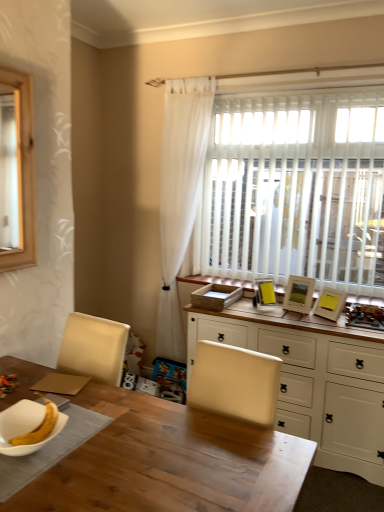
Find the location of a particular element. This screenshot has height=512, width=384. white glossy bowl at lower left is located at coordinates click(x=25, y=426).

At what (x,y) coordinates should I click in order to perform the action: click on white sheer curtain at upper right. Please return your answer as a coordinate pair (x, y). The height and width of the screenshot is (512, 384). Looking at the image, I should click on (180, 195).

The image size is (384, 512). Describe the element at coordinates (180, 195) in the screenshot. I see `white sheer curtain at upper right` at that location.

Image resolution: width=384 pixels, height=512 pixels. Describe the element at coordinates (170, 462) in the screenshot. I see `wooden table at center` at that location.

Locate an element on the screen. This screenshot has width=384, height=512. matte yellow picture frame at upper right, the first picture frame from the left is located at coordinates (264, 293).

From the picture: From a real-world perspective, is white glossy bowl at lower left beneath wooden photo frame at right, the second picture frame in the left-to-right sequence?

Yes.

From the image's perspective, who appears lower, white glossy bowl at lower left or wooden photo frame at right, the second picture frame viewed from the right?

white glossy bowl at lower left, from the image's perspective.

In the image, is white glossy bowl at lower left positioned in front of or behind wooden photo frame at right, the second picture frame viewed from the right?

white glossy bowl at lower left is positioned closer to the viewer than wooden photo frame at right, the second picture frame viewed from the right.

Between wooden table at center and matte yellow picture frame at upper right, the first picture frame from the left, which one is positioned behind?

matte yellow picture frame at upper right, the first picture frame from the left, is more distant.

How many degrees apart are the facing directions of wooden table at center and matte yellow picture frame at upper right, the first picture frame from the left?

The facing directions of wooden table at center and matte yellow picture frame at upper right, the first picture frame from the left, are 42.8 degrees apart.

Does wooden table at center have a greater height compared to matte yellow picture frame at upper right, positioned as the third picture frame in right-to-left order?

Correct, wooden table at center is much taller as matte yellow picture frame at upper right, positioned as the third picture frame in right-to-left order.

Which object is further away from the camera taking this photo, white wood cabinet at center or wooden picture frame at upper right, which appears as the 3th picture frame when viewed from the left?

wooden picture frame at upper right, which appears as the 3th picture frame when viewed from the left, is further from the camera.

Is point (338, 379) positioned after point (326, 314)?

That is False.

Is white wood cabinet at center bigger or smaller than wooden picture frame at upper right, which ranks as the first picture frame in right-to-left order?

white wood cabinet at center is bigger than wooden picture frame at upper right, which ranks as the first picture frame in right-to-left order.

From the image's perspective, which one is positioned lower, white wood cabinet at center or wooden picture frame at upper right, which ranks as the first picture frame in right-to-left order?

From the image's view, white wood cabinet at center is below.

At what (x,y) coordinates should I click in order to perform the action: click on tableware on the left of wooden picture frame at upper right, which appears as the 3th picture frame when viewed from the left. Please return your answer as a coordinate pair (x, y). Looking at the image, I should click on (25, 426).

Is wooden picture frame at upper right, which appears as the 3th picture frame when viewed from the left, surrounding white glossy bowl at lower left?

→ No, white glossy bowl at lower left is not a part of wooden picture frame at upper right, which appears as the 3th picture frame when viewed from the left.

From the image's perspective, is wooden picture frame at upper right, which appears as the 3th picture frame when viewed from the left, located above or below white glossy bowl at lower left?

wooden picture frame at upper right, which appears as the 3th picture frame when viewed from the left, is situated higher than white glossy bowl at lower left in the image.

Which object is positioned more to the left, wooden picture frame at upper right, which ranks as the first picture frame in right-to-left order, or white glossy bowl at lower left?

white glossy bowl at lower left is more to the left.

Can we say white sheer curtain at upper right lies outside wooden picture frame at upper right, which ranks as the first picture frame in right-to-left order?

white sheer curtain at upper right is positioned outside wooden picture frame at upper right, which ranks as the first picture frame in right-to-left order.

Between white sheer curtain at upper right and wooden picture frame at upper right, which ranks as the first picture frame in right-to-left order, which one has smaller size?

Smaller between the two is wooden picture frame at upper right, which ranks as the first picture frame in right-to-left order.

In the scene shown: Does white sheer curtain at upper right lie in front of wooden picture frame at upper right, which appears as the 3th picture frame when viewed from the left?

No, white sheer curtain at upper right is behind wooden picture frame at upper right, which appears as the 3th picture frame when viewed from the left.

Are white sheer curtain at upper right and wooden picture frame at upper right, which ranks as the first picture frame in right-to-left order, beside each other?

No, white sheer curtain at upper right is not next to wooden picture frame at upper right, which ranks as the first picture frame in right-to-left order.

Does white sheer curtain at upper right have a lesser width compared to wooden photo frame at right, the second picture frame in the left-to-right sequence?

No, white sheer curtain at upper right is not thinner than wooden photo frame at right, the second picture frame in the left-to-right sequence.

Considering the positions of objects white sheer curtain at upper right and wooden photo frame at right, the second picture frame in the left-to-right sequence, in the image provided, who is more to the left, white sheer curtain at upper right or wooden photo frame at right, the second picture frame in the left-to-right sequence,?

white sheer curtain at upper right.

Is point (166, 116) positioned behind point (293, 292)?

Yes, it is.

Can you confirm if white glossy bowl at lower left is thinner than wooden picture frame at upper right, which appears as the 3th picture frame when viewed from the left?

Yes, white glossy bowl at lower left is thinner than wooden picture frame at upper right, which appears as the 3th picture frame when viewed from the left.

Visually, is white glossy bowl at lower left positioned to the left or to the right of wooden picture frame at upper right, which appears as the 3th picture frame when viewed from the left?

white glossy bowl at lower left is positioned on wooden picture frame at upper right, which appears as the 3th picture frame when viewed from the left,'s left side.

Measure the distance between white glossy bowl at lower left and wooden picture frame at upper right, which appears as the 3th picture frame when viewed from the left.

white glossy bowl at lower left and wooden picture frame at upper right, which appears as the 3th picture frame when viewed from the left, are 5.84 feet apart from each other.

Is white glossy bowl at lower left oriented towards wooden picture frame at upper right, which appears as the 3th picture frame when viewed from the left?

No.

Where is `the 2nd picture frame behind when counting from the white glossy bowl at lower left`? This screenshot has height=512, width=384. the 2nd picture frame behind when counting from the white glossy bowl at lower left is located at coordinates (299, 294).

From the image's perspective, count 2nd picture frames upward from the wooden table at center and point to it. Please provide its 2D coordinates.

[(264, 293)]

When comparing their distances from wooden table at center, does white sheer curtain at upper right or wooden photo frame at right, the second picture frame viewed from the right, seem further?

white sheer curtain at upper right.

Which object lies nearer to the anchor point white glossy bowl at lower left, wooden table at center or wooden picture frame at upper right, which ranks as the first picture frame in right-to-left order?

Based on the image, wooden table at center appears to be nearer to white glossy bowl at lower left.

When comparing their distances from white sheer curtain at upper right, does white wood cabinet at center or wooden table at center seem further?

wooden table at center is further to white sheer curtain at upper right.

Looking at the image, which one is located further to wooden picture frame at upper right, which ranks as the first picture frame in right-to-left order, white glossy bowl at lower left or white wood cabinet at center?

white glossy bowl at lower left is further to wooden picture frame at upper right, which ranks as the first picture frame in right-to-left order.

From the image, which object appears to be farther from matte yellow picture frame at upper right, positioned as the third picture frame in right-to-left order, white sheer curtain at upper right or white glossy bowl at lower left?

The object further to matte yellow picture frame at upper right, positioned as the third picture frame in right-to-left order, is white glossy bowl at lower left.

Considering their positions, is white glossy bowl at lower left positioned closer to matte yellow picture frame at upper right, the first picture frame from the left, than white wood cabinet at center?

The object closer to matte yellow picture frame at upper right, the first picture frame from the left, is white wood cabinet at center.

When comparing their distances from white sheer curtain at upper right, does wooden picture frame at upper right, which ranks as the first picture frame in right-to-left order, or wooden photo frame at right, the second picture frame in the left-to-right sequence, seem further?

wooden picture frame at upper right, which ranks as the first picture frame in right-to-left order.

Estimate the real-world distances between objects in this image. Which object is further from wooden picture frame at upper right, which appears as the 3th picture frame when viewed from the left, matte yellow picture frame at upper right, positioned as the third picture frame in right-to-left order, or white sheer curtain at upper right?

Based on the image, white sheer curtain at upper right appears to be further to wooden picture frame at upper right, which appears as the 3th picture frame when viewed from the left.

I want to click on picture frame between white glossy bowl at lower left and wooden photo frame at right, the second picture frame in the left-to-right sequence, from front to back, so click(x=330, y=304).

Where is `cabinetry between wooden table at center and wooden photo frame at right, the second picture frame in the left-to-right sequence, along the z-axis`? The width and height of the screenshot is (384, 512). cabinetry between wooden table at center and wooden photo frame at right, the second picture frame in the left-to-right sequence, along the z-axis is located at coordinates (311, 382).

The width and height of the screenshot is (384, 512). Identify the location of picture frame between matte yellow picture frame at upper right, positioned as the third picture frame in right-to-left order, and wooden picture frame at upper right, which ranks as the first picture frame in right-to-left order, from left to right. (299, 294).

This screenshot has width=384, height=512. What are the coordinates of `tableware positioned between wooden table at center and white sheer curtain at upper right from near to far` in the screenshot? It's located at (25, 426).